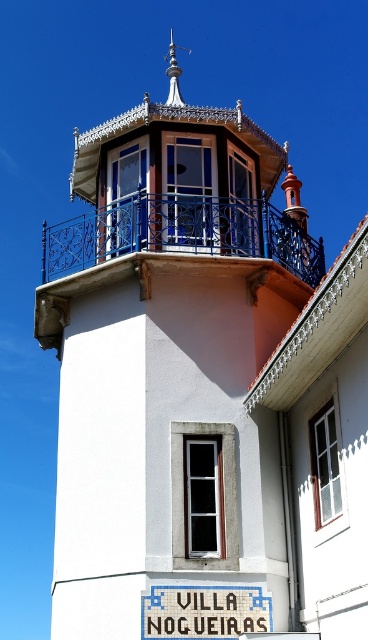
Question: Is blue wrought iron balcony at upper center positioned behind white plastic sign at center?

Choices:
 (A) yes
 (B) no

Answer: (A)

Question: Can you confirm if blue wrought iron balcony at upper center is thinner than white plastic sign at center?

Choices:
 (A) no
 (B) yes

Answer: (A)

Question: Among these objects, which one is nearest to the camera?

Choices:
 (A) white plastic sign at center
 (B) blue wrought iron balcony at upper center

Answer: (A)

Question: Can you confirm if blue wrought iron balcony at upper center is positioned above white plastic sign at center?

Choices:
 (A) yes
 (B) no

Answer: (A)